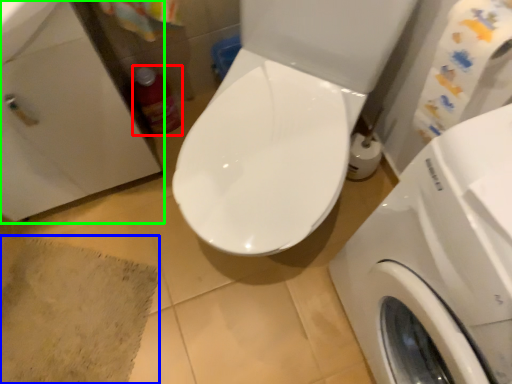
Question: Which object is positioned farthest from cleaning product (highlighted by a red box)? Select from bath mat (highlighted by a blue box) and sink (highlighted by a green box).

Choices:
 (A) bath mat
 (B) sink

Answer: (A)